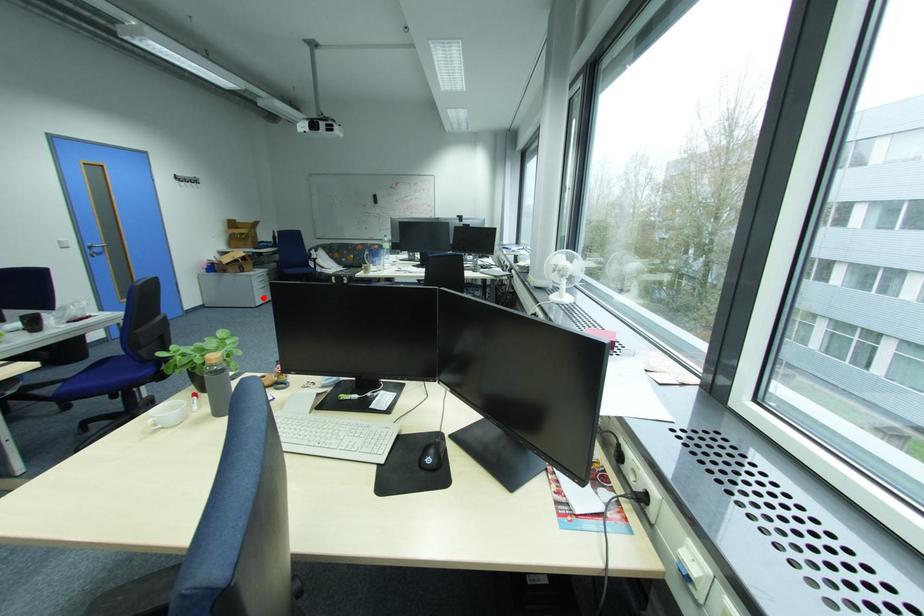
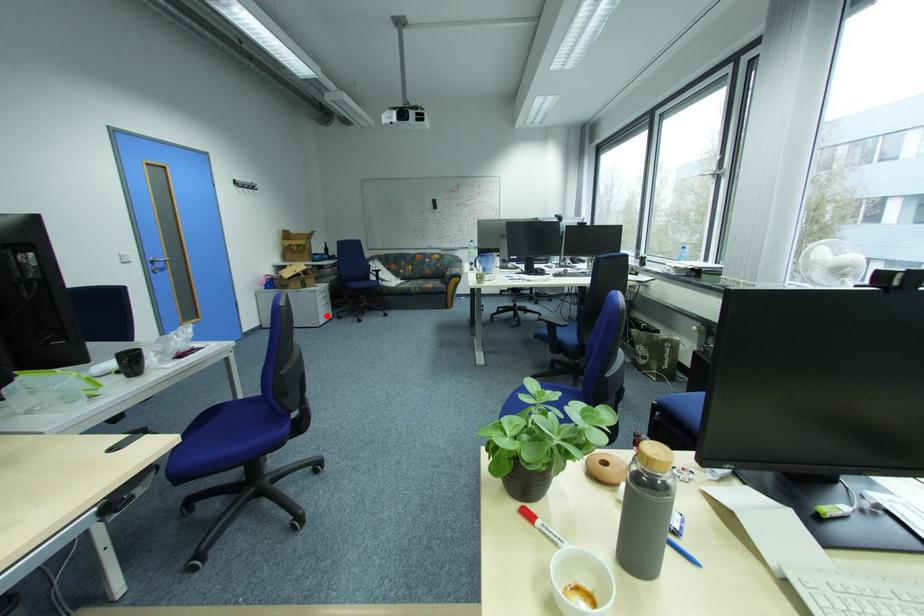
Consider the image. I am providing you with two images of the same scene from different viewpoints. A red point is marked on the first image and another point is marked on the second image. Is the red point in image1 aligned with the point shown in image2?

Yes